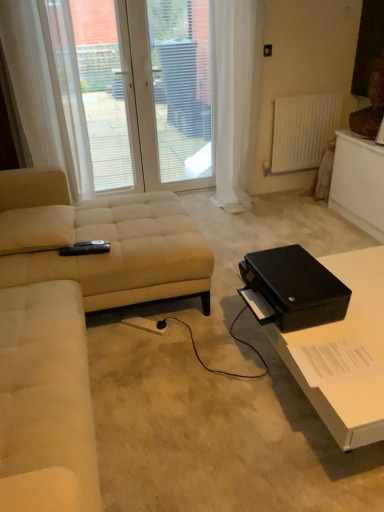
Question: Is white fabric curtain at right, the first curtain viewed from the right, facing towards white matte radiator at upper right?

Choices:
 (A) no
 (B) yes

Answer: (A)

Question: From the image's perspective, is white fabric curtain at right, the first curtain viewed from the right, on white matte radiator at upper right?

Choices:
 (A) no
 (B) yes

Answer: (B)

Question: Is white fabric curtain at right, the first curtain viewed from the right, positioned with its back to white matte radiator at upper right?

Choices:
 (A) yes
 (B) no

Answer: (B)

Question: Can you confirm if white fabric curtain at right, the first curtain viewed from the right, is thinner than white matte radiator at upper right?

Choices:
 (A) yes
 (B) no

Answer: (B)

Question: Considering the relative sizes of white fabric curtain at right, the first curtain viewed from the right, and white matte radiator at upper right in the image provided, is white fabric curtain at right, the first curtain viewed from the right, shorter than white matte radiator at upper right?

Choices:
 (A) yes
 (B) no

Answer: (B)

Question: Would you say beige fabric studio couch at left is to the left or to the right of beige fabric couch at left in the picture?

Choices:
 (A) left
 (B) right

Answer: (A)

Question: Does point (43, 238) appear closer or farther from the camera than point (39, 471)?

Choices:
 (A) farther
 (B) closer

Answer: (A)

Question: From a real-world perspective, is beige fabric studio couch at left above or below beige fabric couch at left?

Choices:
 (A) above
 (B) below

Answer: (B)

Question: Is beige fabric studio couch at left wider or thinner than beige fabric couch at left?

Choices:
 (A) thin
 (B) wide

Answer: (B)

Question: Looking at the image, does transparent glass door at upper center seem bigger or smaller compared to white fabric curtain at right, the first curtain viewed from the right?

Choices:
 (A) small
 (B) big

Answer: (A)

Question: Is point (117, 150) positioned closer to the camera than point (241, 131)?

Choices:
 (A) closer
 (B) farther

Answer: (B)

Question: Is transparent glass door at upper center in front of or behind white fabric curtain at right, positioned as the second curtain in left-to-right order, in the image?

Choices:
 (A) front
 (B) behind

Answer: (B)

Question: From a real-world perspective, is transparent glass door at upper center physically located above or below white fabric curtain at right, positioned as the second curtain in left-to-right order?

Choices:
 (A) above
 (B) below

Answer: (A)

Question: Is white plastic screen door at upper center in front of or behind white glossy table at lower right in the image?

Choices:
 (A) behind
 (B) front

Answer: (A)

Question: In terms of size, does white plastic screen door at upper center appear bigger or smaller than white glossy table at lower right?

Choices:
 (A) big
 (B) small

Answer: (B)